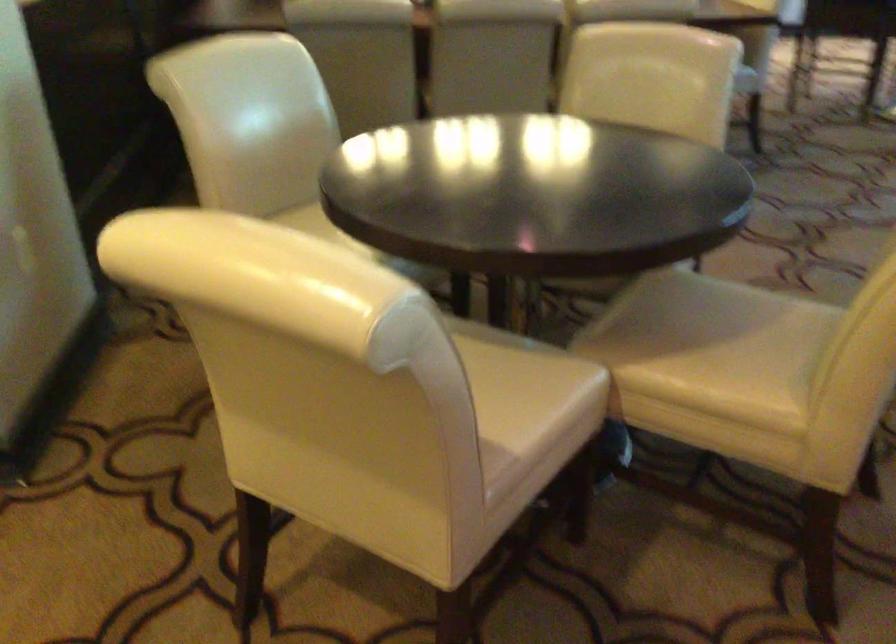
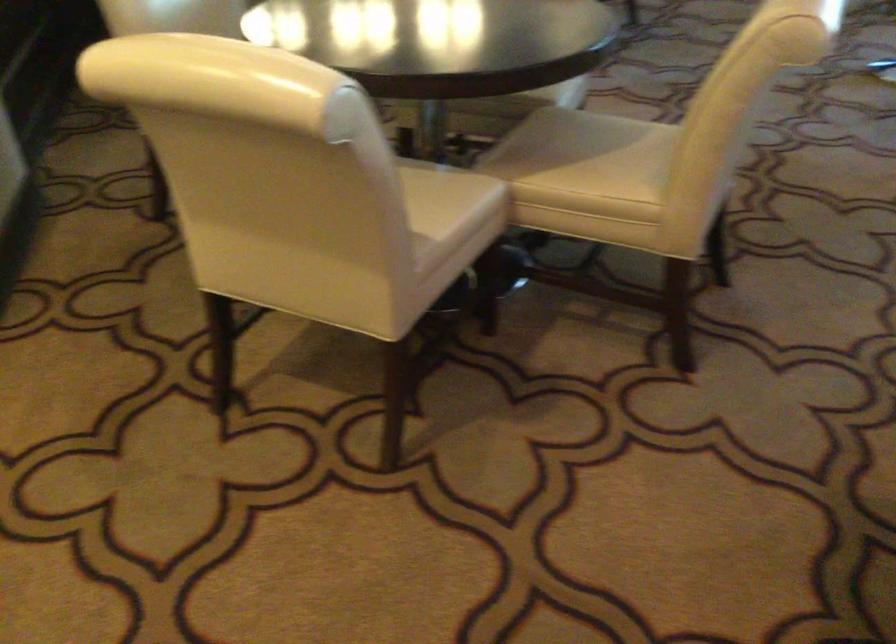
Locate, in the second image, the point that corresponds to point (738, 325) in the first image.

(613, 144)